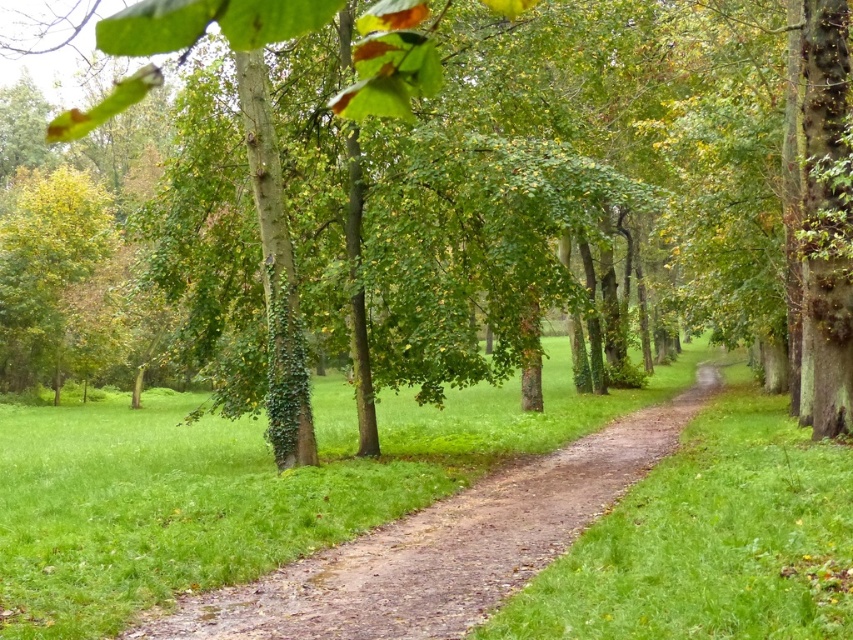
Can you confirm if green leafy tree at center is taller than brown dirt path at center?

Correct, green leafy tree at center is much taller as brown dirt path at center.

Who is more forward, (x=105, y=26) or (x=622, y=490)?

Point (x=622, y=490) is in front.

In order to click on green leafy tree at center in this screenshot , I will do `click(827, 214)`.